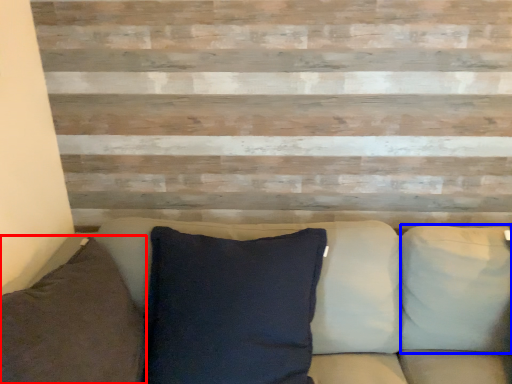
Question: Which point is closer to the camera, pillow (highlighted by a red box) or pillow (highlighted by a blue box)?

Choices:
 (A) pillow
 (B) pillow

Answer: (A)